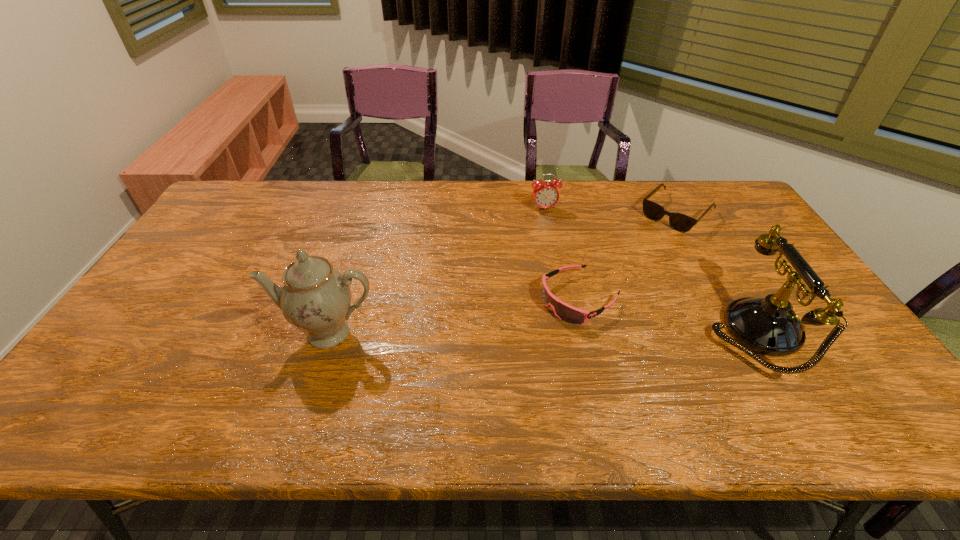
At what (x,y) coordinates should I click in order to perform the action: click on sunglasses present at the right edge. Please return your answer as a coordinate pair (x, y). This screenshot has height=540, width=960. Looking at the image, I should click on (680, 222).

Find the location of `object at the far right corner`. object at the far right corner is located at coordinates coord(680,222).

Image resolution: width=960 pixels, height=540 pixels. I want to click on object positioned at the near right corner, so click(769, 326).

Where is `vacant area at the far edge of the desktop`? This screenshot has width=960, height=540. vacant area at the far edge of the desktop is located at coordinates tap(301, 202).

Find the location of `vacant space at the near edge of the desktop`. vacant space at the near edge of the desktop is located at coordinates (674, 374).

You are a GUI agent. You are given a task and a screenshot of the screen. Output one action in this format:
    pyautogui.click(x=<x>, y=<y>)
    Task: Click on the vacant space at the left edge of the desktop
    The height and width of the screenshot is (540, 960).
    Given the screenshot: What is the action you would take?
    [x=158, y=329]

In the image, there is a desktop. Identify the location of vacant space at the right edge. (820, 331).

The height and width of the screenshot is (540, 960). I want to click on vacant area at the near left corner, so click(x=97, y=384).

Image resolution: width=960 pixels, height=540 pixels. In the image, there is a desktop. In order to click on vacant space at the near right corner in this screenshot , I will do `click(868, 364)`.

Find the location of `unoccupied area between the alarm clock and the sunglasses`. unoccupied area between the alarm clock and the sunglasses is located at coordinates (611, 211).